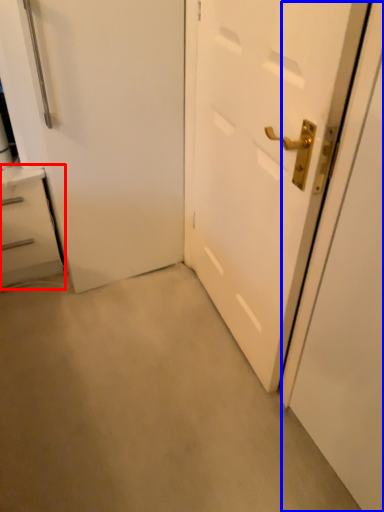
Question: Which object appears farthest to the camera in this image, chest of drawers (highlighted by a red box) or screen door (highlighted by a blue box)?

Choices:
 (A) chest of drawers
 (B) screen door

Answer: (A)